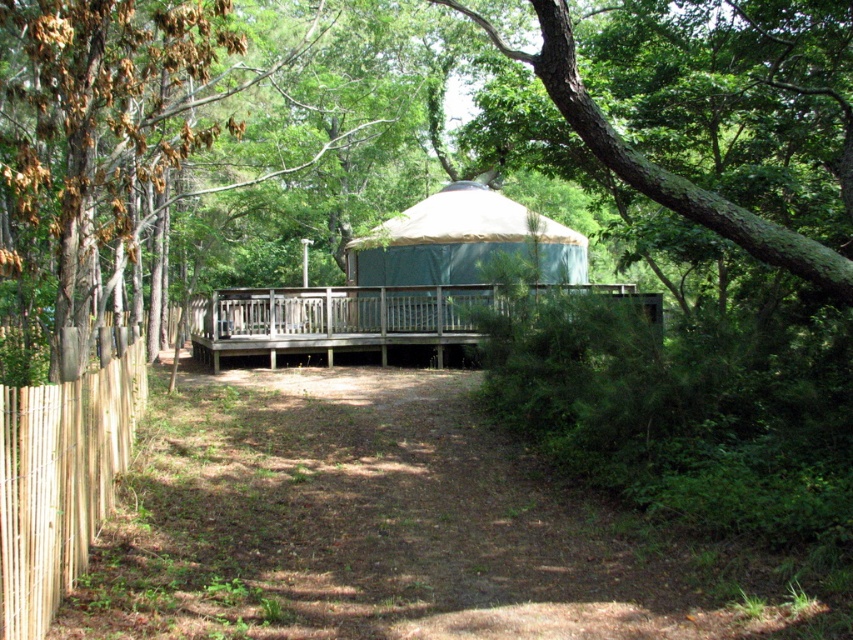
Can you confirm if green leafy tree at center is positioned to the left of green rough bark tree at upper center?

Indeed, green leafy tree at center is positioned on the left side of green rough bark tree at upper center.

Is green leafy tree at center positioned in front of green rough bark tree at upper center?

No.

The image size is (853, 640). What do you see at coordinates (401, 157) in the screenshot?
I see `green leafy tree at center` at bounding box center [401, 157].

Locate an element on the screen. The image size is (853, 640). green leafy tree at center is located at coordinates (401, 157).

Is light brown wooden fence at left taller than green rough bark tree at upper center?

Indeed, light brown wooden fence at left has a greater height compared to green rough bark tree at upper center.

This screenshot has width=853, height=640. I want to click on light brown wooden fence at left, so click(59, 481).

Who is positioned more to the left, wooden deck at center or green rough bark tree at upper center?

From the viewer's perspective, wooden deck at center appears more on the left side.

Who is lower down, wooden deck at center or green rough bark tree at upper center?

wooden deck at center is lower down.

Image resolution: width=853 pixels, height=640 pixels. Describe the element at coordinates (335, 320) in the screenshot. I see `wooden deck at center` at that location.

The height and width of the screenshot is (640, 853). I want to click on wooden deck at center, so click(335, 320).